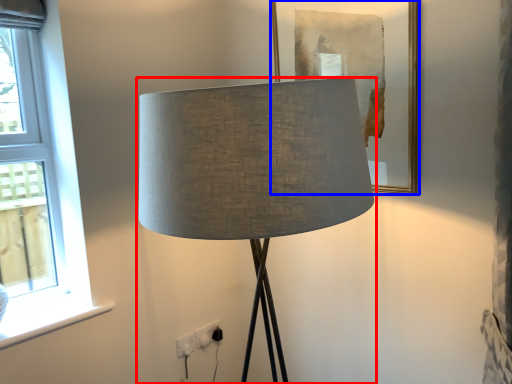
Question: Which object is further to the camera taking this photo, lamp (highlighted by a red box) or picture frame (highlighted by a blue box)?

Choices:
 (A) lamp
 (B) picture frame

Answer: (B)